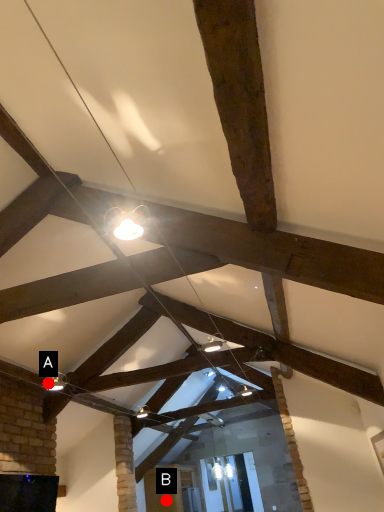
Question: Two points are circled on the image, labeled by A and B beside each circle. Which of the following is the closest to the observer?

Choices:
 (A) A is closer
 (B) B is closer

Answer: (A)